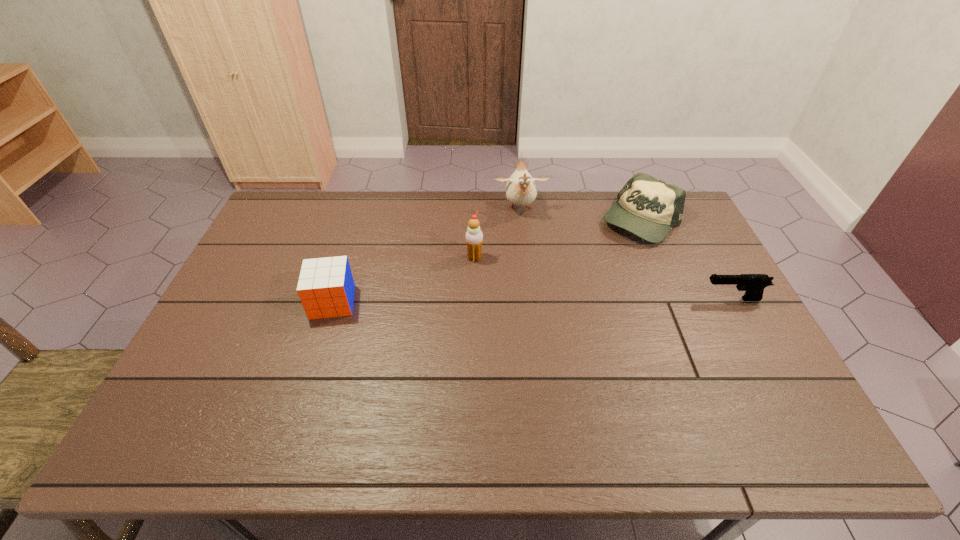
Find the location of a particular element. The image size is (960, 540). cube is located at coordinates (326, 287).

You are a GUI agent. You are given a task and a screenshot of the screen. Output one action in this format:
    pyautogui.click(x=<x>, y=<y>)
    Task: Click on the pistol
    
    Given the screenshot: What is the action you would take?
    pyautogui.click(x=753, y=284)

You are a GUI agent. You are given a task and a screenshot of the screen. Output one action in this format:
    pyautogui.click(x=<x>, y=<y>)
    Task: Click on the baseball cap
    The width and height of the screenshot is (960, 540).
    Given the screenshot: What is the action you would take?
    pyautogui.click(x=647, y=207)

The width and height of the screenshot is (960, 540). I want to click on the second object from left to right, so click(x=474, y=237).

Identify the location of the third nearest object. This screenshot has width=960, height=540. (474, 237).

Where is `bird`? This screenshot has width=960, height=540. bird is located at coordinates (521, 190).

I want to click on vacant space situated on the right of the leftmost object, so click(x=401, y=302).

Find the location of a particular element. The width and height of the screenshot is (960, 540). vacant space located on the front-facing side of the pistol is located at coordinates tap(677, 299).

This screenshot has height=540, width=960. What are the coordinates of `vacant space located on the front-facing side of the pistol` in the screenshot? It's located at (621, 299).

Where is `free space located on the front-facing side of the pistol`? The width and height of the screenshot is (960, 540). free space located on the front-facing side of the pistol is located at coordinates (584, 299).